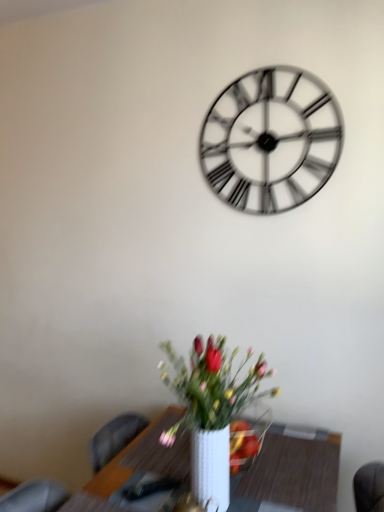
Describe the element at coordinates (295, 472) in the screenshot. I see `white glossy table at lower center` at that location.

Where is `metallic silver clock at upper center`? metallic silver clock at upper center is located at coordinates (271, 140).

Describe the element at coordinates (215, 415) in the screenshot. I see `white ceramic vase at lower center` at that location.

This screenshot has height=512, width=384. In order to click on white glossy table at lower center in this screenshot , I will do `click(295, 472)`.

Is metallic silver clock at upper center with white ceramic vase at lower center?

No, metallic silver clock at upper center is not beside white ceramic vase at lower center.

Considering the sizes of metallic silver clock at upper center and white ceramic vase at lower center in the image, is metallic silver clock at upper center wider or thinner than white ceramic vase at lower center?

Clearly, metallic silver clock at upper center has less width compared to white ceramic vase at lower center.

Locate an element on the screen. The height and width of the screenshot is (512, 384). houseplant below the metallic silver clock at upper center (from the image's perspective) is located at coordinates (215, 415).

From a real-world perspective, is metallic silver clock at upper center located beneath white ceramic vase at lower center?

No, from a real-world perspective, metallic silver clock at upper center is not under white ceramic vase at lower center.

Is metallic silver clock at upper center completely or partially outside of white glossy table at lower center?

Yes.

From a real-world perspective, does metallic silver clock at upper center stand above white glossy table at lower center?

Yes.

Is the depth of metallic silver clock at upper center less than that of white glossy table at lower center?

No, the depth of metallic silver clock at upper center is greater than that of white glossy table at lower center.

Can you tell me how much metallic silver clock at upper center and white glossy table at lower center differ in facing direction?

There is a 1.68-degree angle between the facing directions of metallic silver clock at upper center and white glossy table at lower center.

Between white ceramic vase at lower center and white glossy table at lower center, which one has larger width?

white glossy table at lower center.

Which point is more distant from viewer, [215,452] or [272,488]?

The point [272,488] is behind.

Can you tell me how much white ceramic vase at lower center and white glossy table at lower center differ in facing direction?

0.125 degrees separate the facing orientations of white ceramic vase at lower center and white glossy table at lower center.

Between white ceramic vase at lower center and white glossy table at lower center, which one is positioned behind?

white glossy table at lower center.

From the image's perspective, who appears lower, white ceramic vase at lower center or metallic silver clock at upper center?

From the image's view, white ceramic vase at lower center is below.

Is point (175, 368) positioned in front of point (289, 72)?

Yes, point (175, 368) is in front of point (289, 72).

Is white ceramic vase at lower center shorter than metallic silver clock at upper center?

Yes, white ceramic vase at lower center is shorter than metallic silver clock at upper center.

From a real-world perspective, which is physically below, white ceramic vase at lower center or metallic silver clock at upper center?

In real-world perspective, white ceramic vase at lower center is lower.

Can you confirm if white glossy table at lower center is thinner than white ceramic vase at lower center?

No, white glossy table at lower center is not thinner than white ceramic vase at lower center.

Which point is more distant from viewer, (170, 455) or (194, 404)?

Point (170, 455)

In the scene shown: Is white glossy table at lower center at the right side of white ceramic vase at lower center?

Yes, white glossy table at lower center is to the right of white ceramic vase at lower center.

Who is taller, white glossy table at lower center or white ceramic vase at lower center?

With more height is white ceramic vase at lower center.

From a real-world perspective, is white glossy table at lower center below metallic silver clock at upper center?

Yes, from a real-world perspective, white glossy table at lower center is below metallic silver clock at upper center.

Is the depth of white glossy table at lower center less than that of metallic silver clock at upper center?

Yes, the depth of white glossy table at lower center is less than that of metallic silver clock at upper center.

Is white glossy table at lower center not near metallic silver clock at upper center?

white glossy table at lower center is far away from metallic silver clock at upper center.

Considering the sizes of objects white glossy table at lower center and metallic silver clock at upper center in the image provided, who is bigger, white glossy table at lower center or metallic silver clock at upper center?

white glossy table at lower center is bigger.

Where is `houseplant that is on the left side of metallic silver clock at upper center`? The width and height of the screenshot is (384, 512). houseplant that is on the left side of metallic silver clock at upper center is located at coordinates (215, 415).

This screenshot has height=512, width=384. What are the coordinates of `table that appears in front of the metallic silver clock at upper center` in the screenshot? It's located at (295, 472).

Estimate the real-world distances between objects in this image. Which object is closer to white ceramic vase at lower center, white glossy table at lower center or metallic silver clock at upper center?

white glossy table at lower center is positioned closer to the anchor white ceramic vase at lower center.

Looking at the image, which one is located further to metallic silver clock at upper center, white ceramic vase at lower center or white glossy table at lower center?

Based on the image, white glossy table at lower center appears to be further to metallic silver clock at upper center.

From the image, which object appears to be farther from white glossy table at lower center, metallic silver clock at upper center or white ceramic vase at lower center?

Among the two, metallic silver clock at upper center is located further to white glossy table at lower center.

Considering their positions, is metallic silver clock at upper center positioned closer to white ceramic vase at lower center than white glossy table at lower center?

Based on the image, white glossy table at lower center appears to be nearer to white ceramic vase at lower center.

Which object lies further to the anchor point metallic silver clock at upper center, white glossy table at lower center or white ceramic vase at lower center?

Based on the image, white glossy table at lower center appears to be further to metallic silver clock at upper center.

When comparing their distances from white glossy table at lower center, does white ceramic vase at lower center or metallic silver clock at upper center seem closer?

Based on the image, white ceramic vase at lower center appears to be nearer to white glossy table at lower center.

You are a GUI agent. You are given a task and a screenshot of the screen. Output one action in this format:
    pyautogui.click(x=<x>, y=<y>)
    Task: Click on the houseplant between metallic silver clock at upper center and white glossy table at lower center in the vertical direction
    
    Given the screenshot: What is the action you would take?
    pyautogui.click(x=215, y=415)